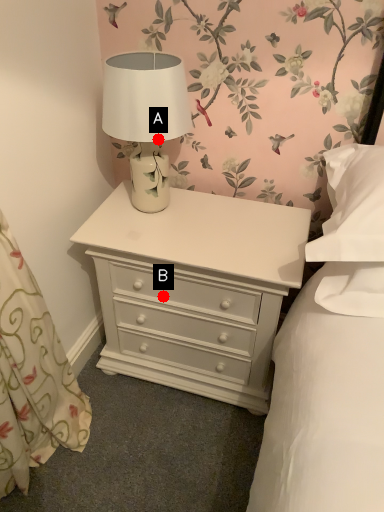
Question: Two points are circled on the image, labeled by A and B beside each circle. Which point appears farthest from the camera in this image?

Choices:
 (A) A is further
 (B) B is further

Answer: (B)